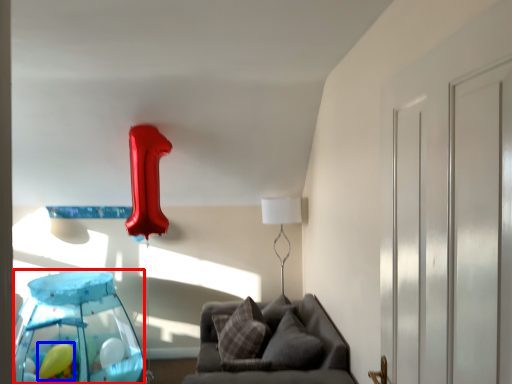
Question: Which point is closer to the camera, glass table (highlighted by a red box) or balloon (highlighted by a blue box)?

Choices:
 (A) glass table
 (B) balloon

Answer: (A)